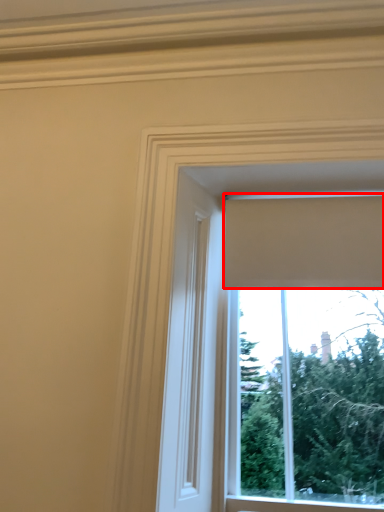
Question: From the image's perspective, where is curtain (annotated by the red box) located relative to window?

Choices:
 (A) above
 (B) below

Answer: (A)